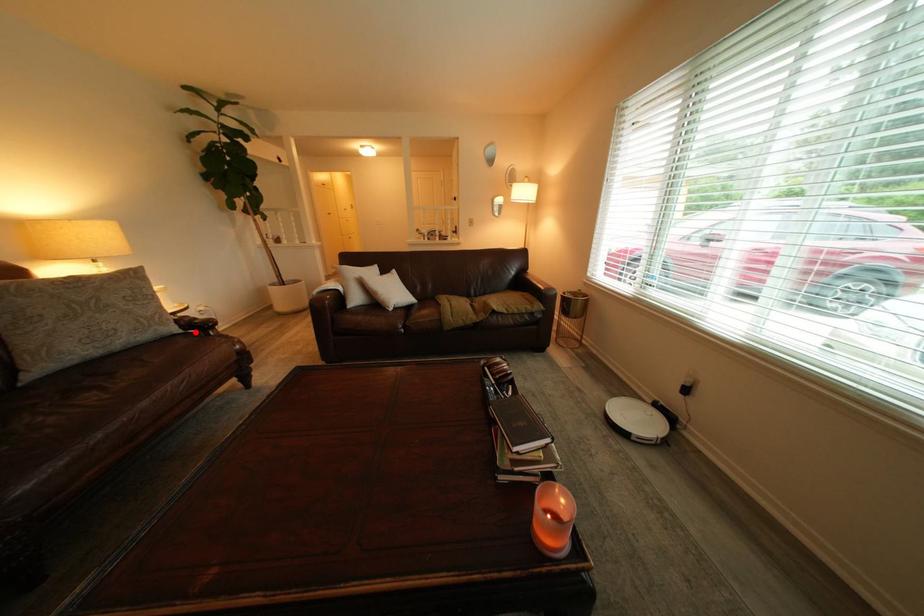
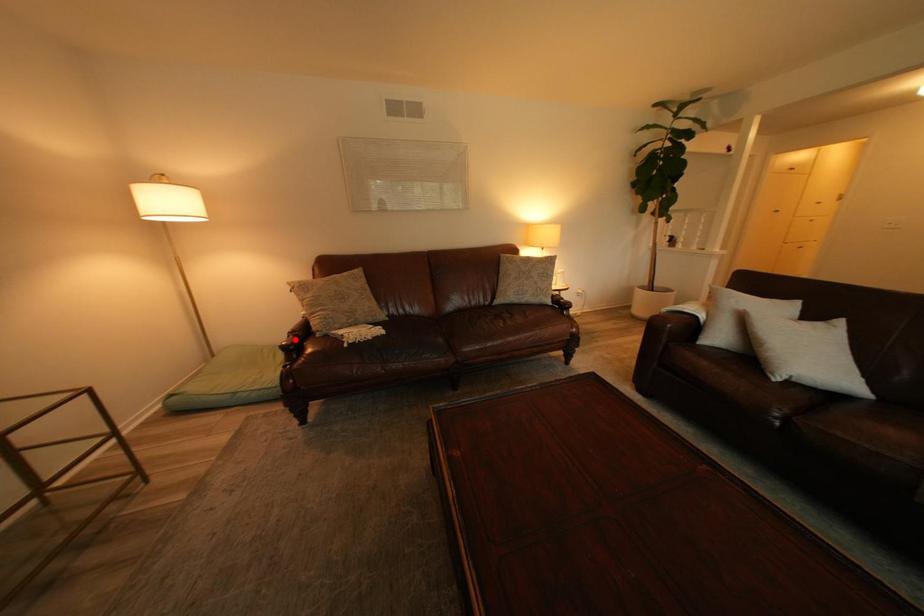
I am providing you with two images of the same scene from different viewpoints. A red point is marked on the first image and another point is marked on the second image. Is the marked point in image1 the same physical position as the marked point in image2?

No